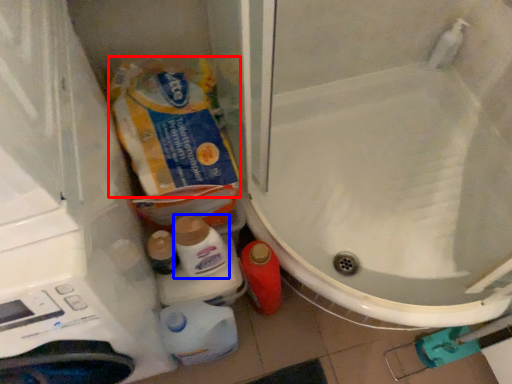
Question: Which object appears farthest to the camera in this image, product (highlighted by a red box) or cleaning product (highlighted by a blue box)?

Choices:
 (A) product
 (B) cleaning product

Answer: (A)